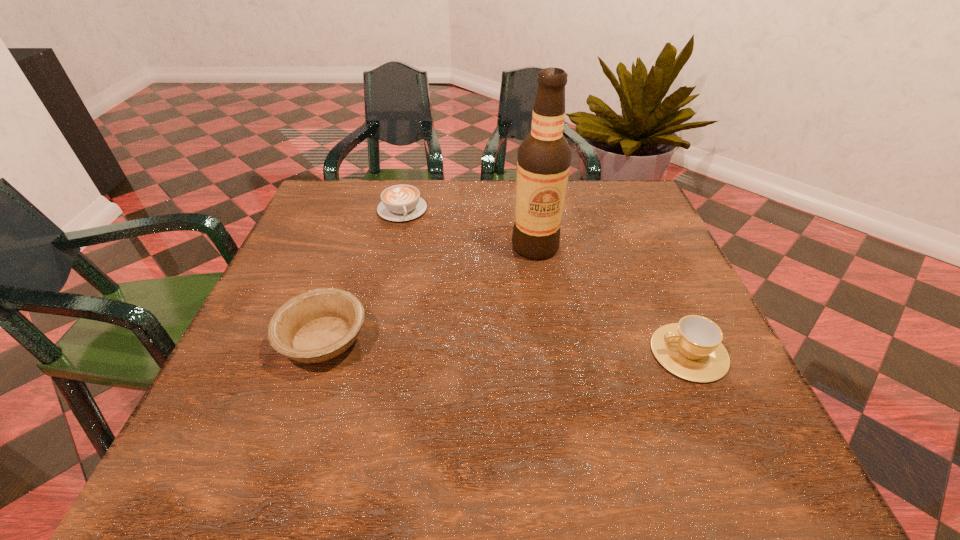
Identify the location of vacant space located on the side of the farthest object with the handle. (x=444, y=324).

The width and height of the screenshot is (960, 540). In order to click on vacant region located on the side of the farthest object with the handle in this screenshot , I will do 445,331.

The image size is (960, 540). Identify the location of vacant space located 0.160m on the side of the farthest object with the handle. (420, 261).

I want to click on vacant area situated on the label of the third object from left to right, so click(520, 280).

The image size is (960, 540). In order to click on free region located on the label of the third object from left to right in this screenshot , I will do `click(513, 297)`.

I want to click on free spot located on the label of the third object from left to right, so click(x=520, y=280).

I want to click on object present at the far edge, so click(399, 202).

Where is `bowl located in the near edge section of the desktop`? bowl located in the near edge section of the desktop is located at coordinates (318, 325).

Find the location of a particular element. The image size is (960, 540). cup present at the near edge is located at coordinates (691, 349).

You are a GUI agent. You are given a task and a screenshot of the screen. Output one action in this format:
    pyautogui.click(x=<x>, y=<y>)
    Task: Click on the object that is at the left edge
    Image resolution: width=960 pixels, height=540 pixels.
    Given the screenshot: What is the action you would take?
    pyautogui.click(x=318, y=325)